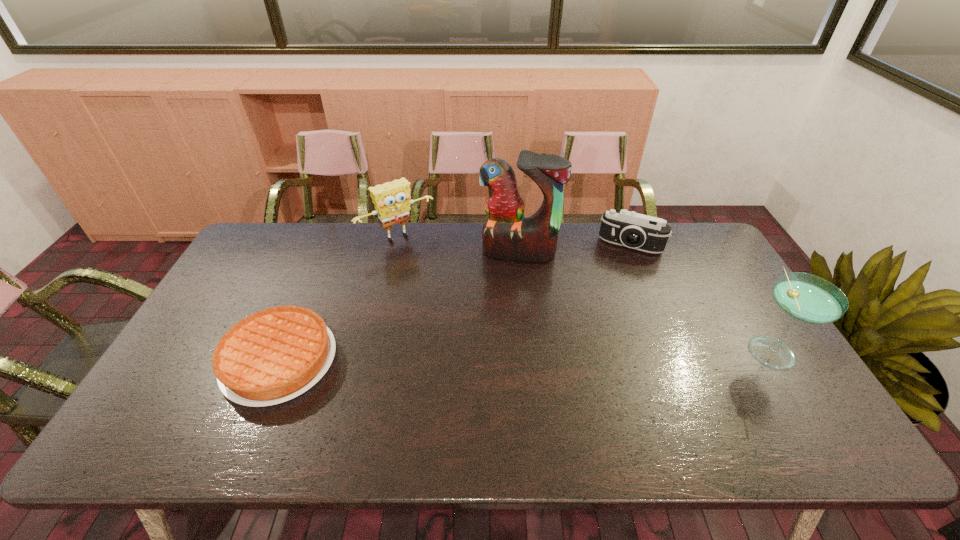
Where is `camera located at the far edge`? Image resolution: width=960 pixels, height=540 pixels. camera located at the far edge is located at coordinates (629, 229).

This screenshot has height=540, width=960. Find the location of `object that is at the near edge`. object that is at the near edge is located at coordinates (272, 356).

The height and width of the screenshot is (540, 960). In order to click on object located at the left edge in this screenshot , I will do (x=272, y=356).

Locate an element on the screen. This screenshot has height=540, width=960. object that is at the right edge is located at coordinates (807, 298).

The image size is (960, 540). Identify the location of object present at the near left corner. (272, 356).

Identify the location of vacant area at the far edge. (421, 230).

Identify the location of free spot at the left edge of the desktop. (269, 272).

In the image, there is a desktop. At what (x,y) coordinates should I click in order to perform the action: click on vacant space at the right edge. Please return your answer as a coordinate pair (x, y). The height and width of the screenshot is (540, 960). Looking at the image, I should click on (696, 301).

Find the location of a particular element. The width and height of the screenshot is (960, 540). free space at the far left corner of the desktop is located at coordinates (294, 241).

What are the coordinates of `free space at the far right corner of the desktop` in the screenshot? It's located at (708, 264).